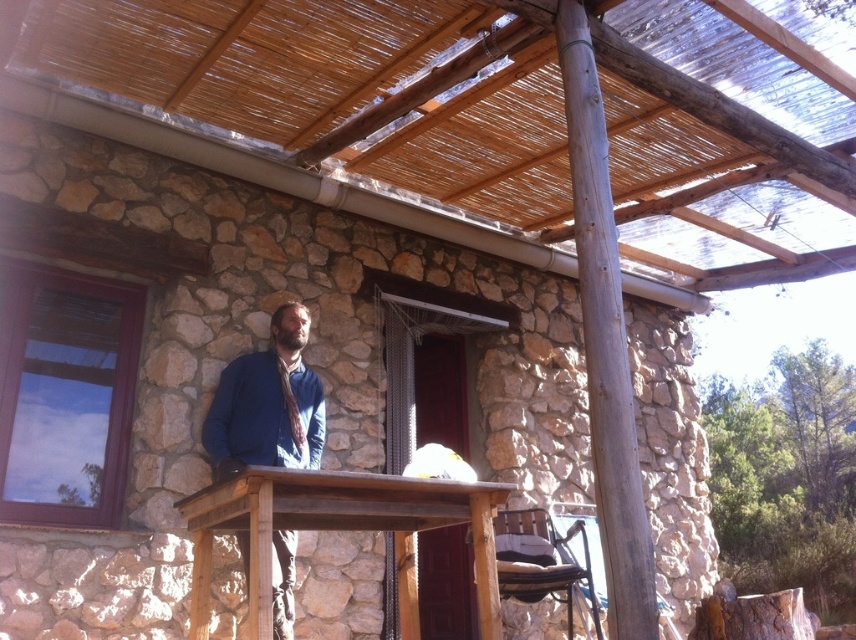
In the scene shown: You are planning to install a new lighting fixture in the rustic outdoor setting. The fixture requires a support structure that can accommodate its width. Given the natural thatched roof at upper center and the rustic wood table at center, which object would be more suitable for mounting the fixture based on their widths?

The natural thatched roof at upper center has a larger width than the rustic wood table at center, making it more suitable for mounting the lighting fixture that requires a wider support structure.